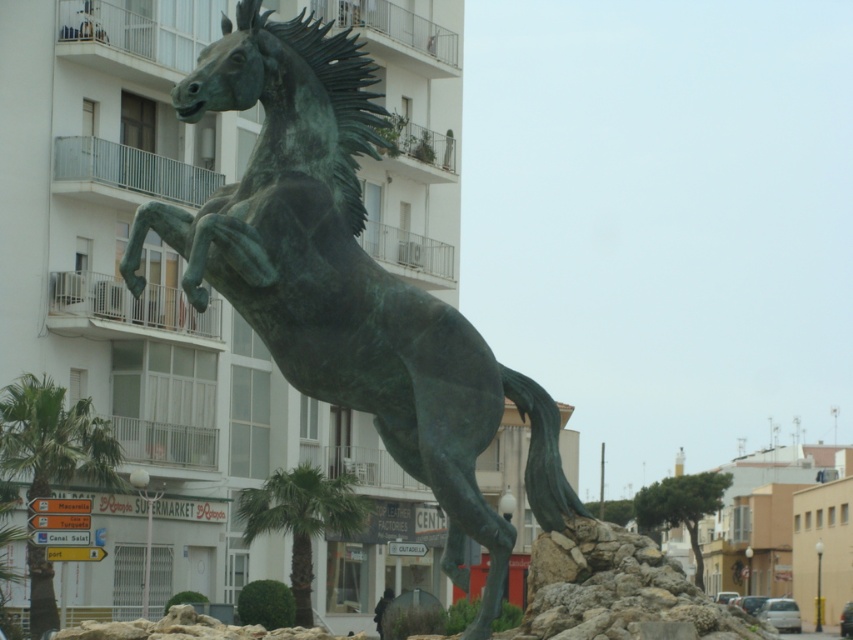
You are standing at the camera position and want to take a photo of the green patina bronze horse at center. If your camera has a maximum focus range of 30 meters, will you be able to focus on the horse?

The green patina bronze horse at center and camera are 35.62 meters apart from each other. Since the distance exceeds the camera maximum focus range of 30 meters, the camera cannot focus on the horse.

You are a city planner assessing the public space around the green patina bronze horse at center and the green leafy palm tree at lower left. Which object would require more space for maintenance equipment access, and why?

The green patina bronze horse at center requires more space for maintenance equipment access because it has a larger size compared to the green leafy palm tree at lower left.

In the scene shown: You are standing in front of the bronze statue of a rearing horse. To your left, there is a green leafy palm tree at lower left. Can you determine if the palm tree is positioned to the left or right of the statue?

The green leafy palm tree at lower left is located at point 0.684 on the x and y coordinates, which places it to the left side of the statue.